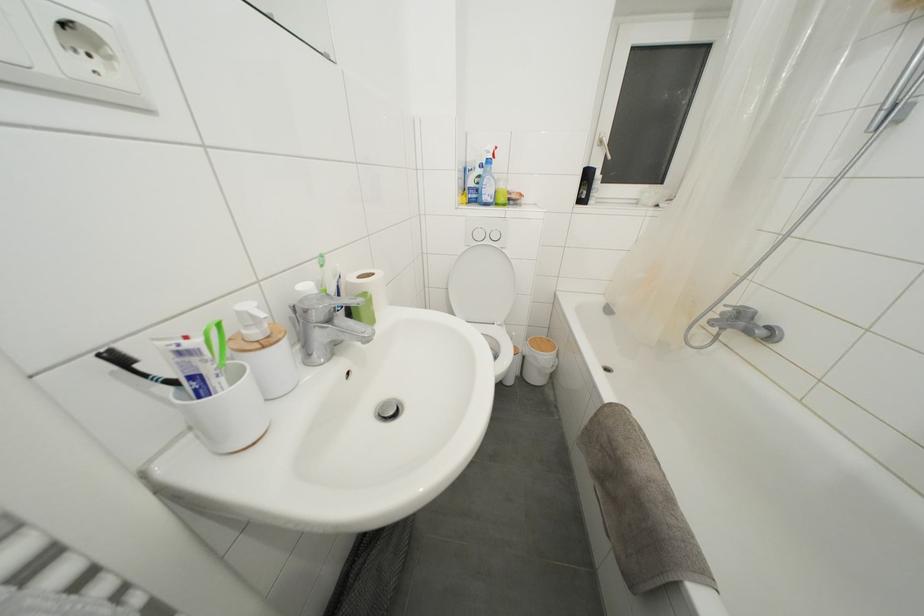
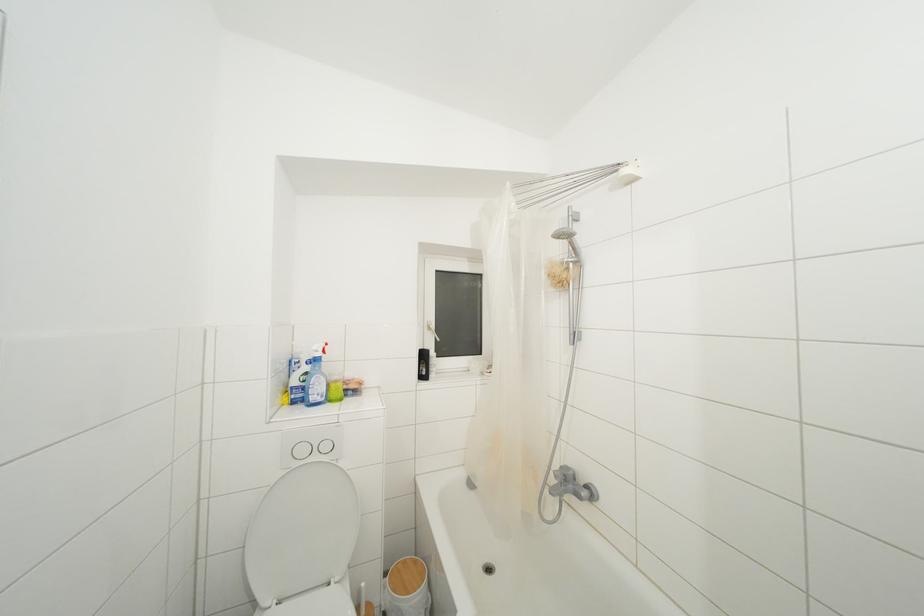
Locate, in the second image, the point that corresponds to [604,148] in the first image.

(433, 333)